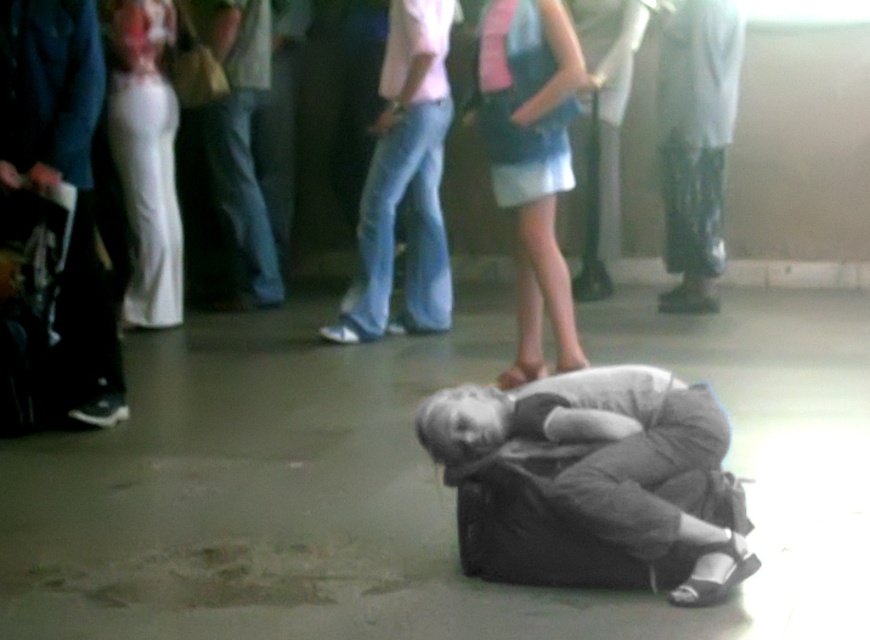
You are a fashion designer observing a person wearing light blue denim jeans at center and blue denim skirt at center. Which clothing item is longer?

The light blue denim jeans at center are much taller than the blue denim skirt at center, so the jeans are longer.

You are a first responder arriving at the scene. You see a person lying on the floor with a dark gray fabric bag at center and a blue denim skirt at center. Which object is wider?

The dark gray fabric bag at center is wider than the blue denim skirt at center according to the description.

You are a first responder arriving at the scene. You see a dark gray fabric bag at center and a blue denim skirt at center. Which object is located to the right of the other?

The dark gray fabric bag at center is to the right of the blue denim skirt at center.